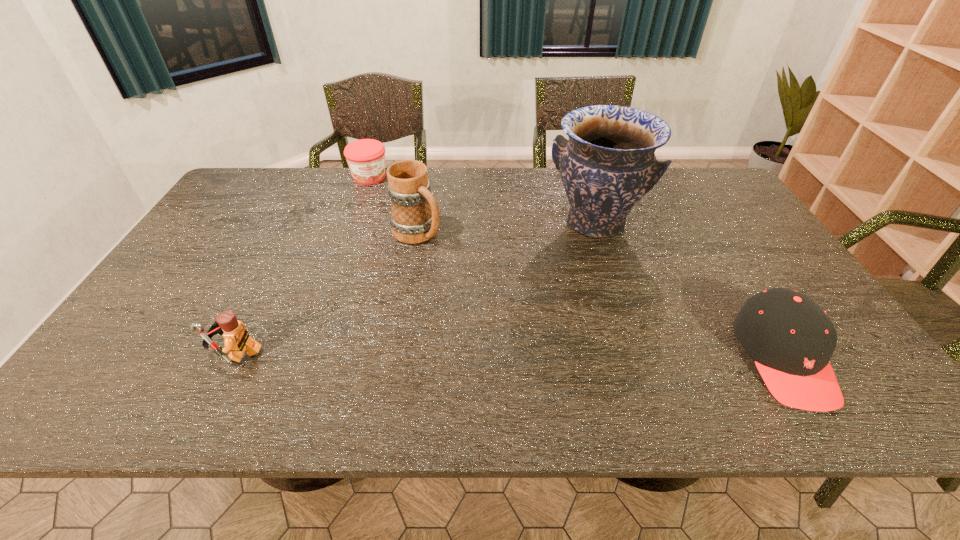
What are the coordinates of `free space on the desktop that is between the Lego and the cap and is positioned on the side of the second tallest object with the handle` in the screenshot? It's located at (583, 356).

Where is `vacant spot on the desktop that is between the Lego and the rightmost object and is positioned on the label side of the shortest object`? vacant spot on the desktop that is between the Lego and the rightmost object and is positioned on the label side of the shortest object is located at coordinates coord(428,355).

Where is `free space on the desktop that is between the leftmost object and the cap and is positioned on the front handle of the tallest object`? This screenshot has width=960, height=540. free space on the desktop that is between the leftmost object and the cap and is positioned on the front handle of the tallest object is located at coordinates (539, 356).